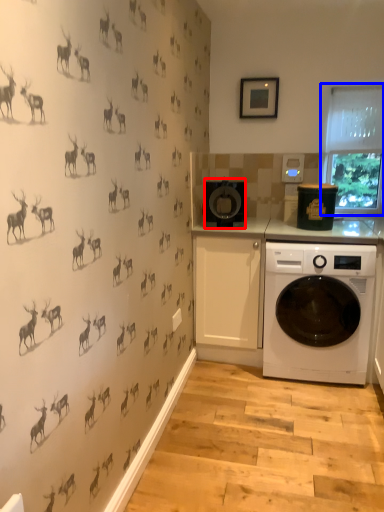
Question: Which of the following is the closest to the observer, appliance (highlighted by a red box) or window screen (highlighted by a blue box)?

Choices:
 (A) appliance
 (B) window screen

Answer: (A)